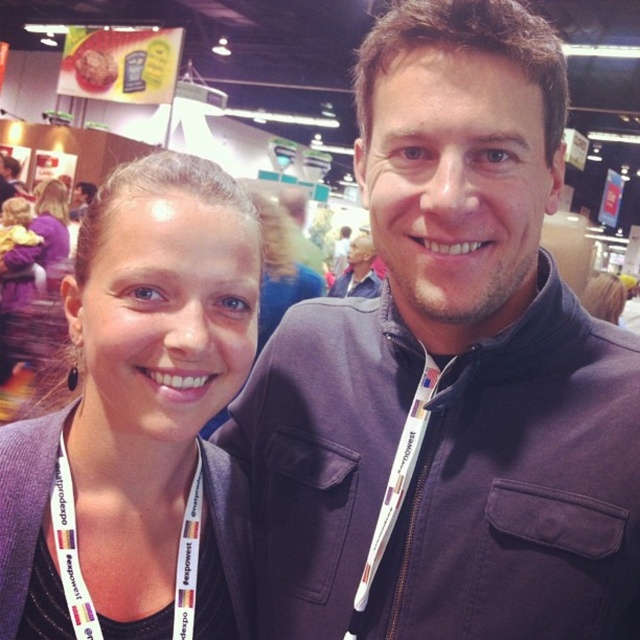
Question: Estimate the real-world distances between objects in this image. Which object is farther from the dark blue jacket at center?

Choices:
 (A) matte purple blazer at left
 (B) white fabric lanyard at lower left

Answer: (B)

Question: Among these points, which one is farthest from the camera?

Choices:
 (A) (490, 333)
 (B) (189, 506)

Answer: (B)

Question: Which object is the closest to the matte black neck at center?

Choices:
 (A) white fabric lanyard at lower left
 (B) matte gray neck at center
 (C) matte black jacket at center

Answer: (A)

Question: Is matte gray neck at center to the left of white fabric lanyard at lower left from the viewer's perspective?

Choices:
 (A) yes
 (B) no

Answer: (B)

Question: Is matte black neck at center to the left of matte black jacket at center from the viewer's perspective?

Choices:
 (A) yes
 (B) no

Answer: (A)

Question: Does dark blue jacket at center come in front of matte purple blazer at left?

Choices:
 (A) yes
 (B) no

Answer: (A)